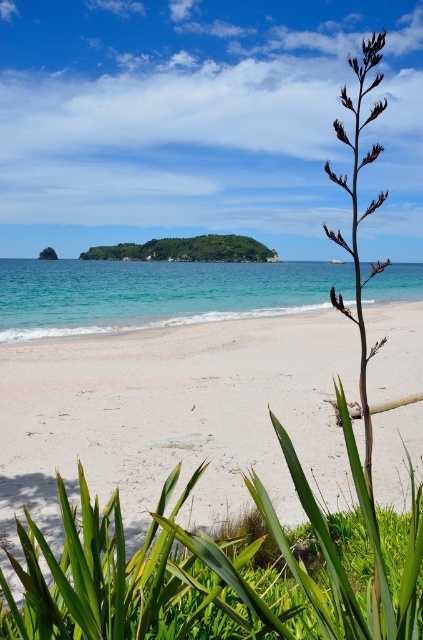
You are standing at point (104,253) and want to walk to the ocean. Which direction should you move relative to point (62,422)?

You should move towards point (62,422) because it is in front of point (104,253), so moving towards it will lead you closer to the ocean.

You are standing on the white sandy beach at center and want to walk to the green leafy island at center. Which path would require walking a shorter distance?

The white sandy beach at center is thinner than the green leafy island at center, so the path to the green leafy island at center is wider. However, since both are at the same center position, the distance to reach either would be the same. You need to clarify your direction or target location.